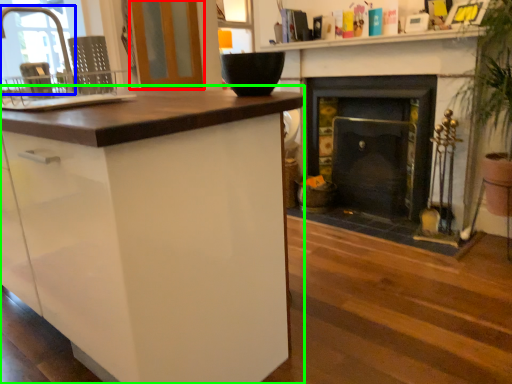
Question: Which is farther away from screen door (highlighted by a red box)? faucet (highlighted by a blue box) or cabinetry (highlighted by a green box)?

Choices:
 (A) faucet
 (B) cabinetry

Answer: (B)